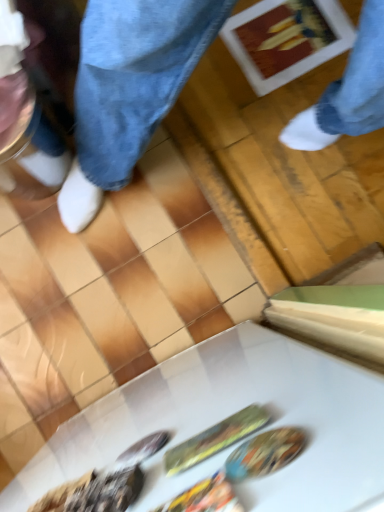
Measure the distance between white glossy table at lower center and camera.

The distance of white glossy table at lower center from camera is 7.87 inches.

This screenshot has height=512, width=384. Describe the element at coordinates (227, 416) in the screenshot. I see `white glossy table at lower center` at that location.

What do you see at coordinates (94, 493) in the screenshot? I see `shiny metallic spoon at lower left, the third food from the right` at bounding box center [94, 493].

Find the location of `shiny plastic bag at center, the second food from the left`. shiny plastic bag at center, the second food from the left is located at coordinates (205, 497).

From a real-world perspective, is shiny metallic spoon at lower left, placed as the first food when sorted from left to right, positioned above or below shiny plastic spoon at center, arranged as the first food when viewed from the right?

Clearly, from a real-world perspective, shiny metallic spoon at lower left, placed as the first food when sorted from left to right, is above shiny plastic spoon at center, arranged as the first food when viewed from the right.

Is shiny metallic spoon at lower left, placed as the first food when sorted from left to right, positioned before shiny plastic spoon at center, which ranks as the third food in left-to-right order?

Yes, it is in front of shiny plastic spoon at center, which ranks as the third food in left-to-right order.

Is shiny plastic spoon at center, arranged as the first food when viewed from the right, inside shiny metallic spoon at lower left, placed as the first food when sorted from left to right?

No, shiny plastic spoon at center, arranged as the first food when viewed from the right, is not inside shiny metallic spoon at lower left, placed as the first food when sorted from left to right.

At what (x,y) coordinates should I click in order to perform the action: click on food that is the 1st object located in front of the shiny plastic spoon at center, which ranks as the third food in left-to-right order. Please return your answer as a coordinate pair (x, y). This screenshot has width=384, height=512. Looking at the image, I should click on (94, 493).

In terms of height, does shiny plastic bag at center, the second food from the left, look taller or shorter compared to white glossy table at lower center?

Considering their sizes, shiny plastic bag at center, the second food from the left, has less height than white glossy table at lower center.

Is shiny plastic bag at center, positioned as the second food in right-to-left order, far away from white glossy table at lower center?

No.

In the image, is shiny plastic bag at center, the second food from the left, positioned in front of or behind white glossy table at lower center?

Clearly, shiny plastic bag at center, the second food from the left, is behind white glossy table at lower center.

Where is `table below the shiny plastic bag at center, the second food from the left (from the image's perspective)`? This screenshot has width=384, height=512. table below the shiny plastic bag at center, the second food from the left (from the image's perspective) is located at coordinates (227, 416).

Based on their positions, is shiny plastic spoon at center, arranged as the first food when viewed from the right, located to the left or right of shiny plastic bag at center, positioned as the second food in right-to-left order?

shiny plastic spoon at center, arranged as the first food when viewed from the right, is positioned on shiny plastic bag at center, positioned as the second food in right-to-left order,'s right side.

Consider the image. From a real-world perspective, is shiny plastic spoon at center, which ranks as the third food in left-to-right order, over shiny plastic bag at center, the second food from the left?

No.

Looking at the image, does shiny plastic spoon at center, arranged as the first food when viewed from the right, seem bigger or smaller compared to shiny plastic bag at center, positioned as the second food in right-to-left order?

Considering their sizes, shiny plastic spoon at center, arranged as the first food when viewed from the right, takes up more space than shiny plastic bag at center, positioned as the second food in right-to-left order.

Is shiny plastic spoon at center, which ranks as the third food in left-to-right order, wider than shiny plastic bag at center, positioned as the second food in right-to-left order?

Incorrect, the width of shiny plastic spoon at center, which ranks as the third food in left-to-right order, does not surpass that of shiny plastic bag at center, positioned as the second food in right-to-left order.

Does white glossy table at lower center have a lesser height compared to shiny plastic spoon at center, which ranks as the third food in left-to-right order?

Incorrect, the height of white glossy table at lower center does not fall short of that of shiny plastic spoon at center, which ranks as the third food in left-to-right order.

Would you say shiny plastic spoon at center, arranged as the first food when viewed from the right, is part of white glossy table at lower center's contents?

That's correct, shiny plastic spoon at center, arranged as the first food when viewed from the right, is inside white glossy table at lower center.

Is shiny metallic spoon at lower left, the third food from the right, at the back of white glossy table at lower center?

No.

Based on the photo, is white glossy table at lower center taller than shiny metallic spoon at lower left, the third food from the right?

Yes.

From the image's perspective, is white glossy table at lower center located beneath shiny plastic bag at center, the second food from the left?

Correct, white glossy table at lower center appears lower than shiny plastic bag at center, the second food from the left, in the image.

From a real-world perspective, is white glossy table at lower center above or below shiny plastic bag at center, positioned as the second food in right-to-left order?

white glossy table at lower center is situated lower than shiny plastic bag at center, positioned as the second food in right-to-left order, in the real world.

Does point (361, 495) appear closer or farther from the camera than point (238, 508)?

Point (361, 495) is positioned closer to the camera compared to point (238, 508).

Is white glossy table at lower center completely or partially outside of shiny plastic bag at center, positioned as the second food in right-to-left order?

Yes.

Between shiny plastic bag at center, positioned as the second food in right-to-left order, and shiny plastic spoon at center, arranged as the first food when viewed from the right, which one has smaller size?

shiny plastic bag at center, positioned as the second food in right-to-left order, is smaller.

From the image's perspective, which is below, shiny plastic bag at center, positioned as the second food in right-to-left order, or shiny plastic spoon at center, arranged as the first food when viewed from the right?

From the image's view, shiny plastic bag at center, positioned as the second food in right-to-left order, is below.

In the scene shown: From a real-world perspective, does shiny plastic bag at center, positioned as the second food in right-to-left order, stand above shiny plastic spoon at center, which ranks as the third food in left-to-right order?

Yes, from a real-world perspective, shiny plastic bag at center, positioned as the second food in right-to-left order, is on top of shiny plastic spoon at center, which ranks as the third food in left-to-right order.

From a real-world perspective, count 1st foods upward from the shiny plastic spoon at center, arranged as the first food when viewed from the right, and point to it. Please provide its 2D coordinates.

[(94, 493)]

Identify the location of table located underneath the shiny plastic bag at center, positioned as the second food in right-to-left order (from a real-world perspective). The height and width of the screenshot is (512, 384). (227, 416).

Looking at the image, which one is located further to shiny plastic bag at center, positioned as the second food in right-to-left order, shiny metallic spoon at lower left, the third food from the right, or shiny plastic spoon at center, arranged as the first food when viewed from the right?

shiny metallic spoon at lower left, the third food from the right, is positioned further to the anchor shiny plastic bag at center, positioned as the second food in right-to-left order.

Which object lies further to the anchor point shiny plastic spoon at center, arranged as the first food when viewed from the right, shiny plastic bag at center, positioned as the second food in right-to-left order, or shiny metallic spoon at lower left, the third food from the right?

shiny metallic spoon at lower left, the third food from the right, is further to shiny plastic spoon at center, arranged as the first food when viewed from the right.

Based on the photo, from the image, which object appears to be farther from shiny plastic spoon at center, arranged as the first food when viewed from the right, shiny metallic spoon at lower left, placed as the first food when sorted from left to right, or white glossy table at lower center?

The object further to shiny plastic spoon at center, arranged as the first food when viewed from the right, is white glossy table at lower center.

Which object lies further to the anchor point white glossy table at lower center, shiny plastic bag at center, positioned as the second food in right-to-left order, or shiny metallic spoon at lower left, the third food from the right?

shiny plastic bag at center, positioned as the second food in right-to-left order, lies further to white glossy table at lower center than the other object.

Consider the image. Estimate the real-world distances between objects in this image. Which object is further from white glossy table at lower center, shiny plastic bag at center, the second food from the left, or shiny plastic spoon at center, which ranks as the third food in left-to-right order?

shiny plastic bag at center, the second food from the left.

In the scene shown: Looking at the image, which one is located further to shiny plastic bag at center, the second food from the left, shiny plastic spoon at center, arranged as the first food when viewed from the right, or shiny metallic spoon at lower left, the third food from the right?

shiny metallic spoon at lower left, the third food from the right, lies further to shiny plastic bag at center, the second food from the left, than the other object.

From the image, which object appears to be farther from shiny metallic spoon at lower left, the third food from the right, shiny plastic spoon at center, which ranks as the third food in left-to-right order, or shiny plastic bag at center, positioned as the second food in right-to-left order?

The object further to shiny metallic spoon at lower left, the third food from the right, is shiny plastic bag at center, positioned as the second food in right-to-left order.

Looking at the image, which one is located further to shiny metallic spoon at lower left, the third food from the right, white glossy table at lower center or shiny plastic spoon at center, arranged as the first food when viewed from the right?

white glossy table at lower center lies further to shiny metallic spoon at lower left, the third food from the right, than the other object.

The image size is (384, 512). Identify the location of food between shiny plastic bag at center, the second food from the left, and white glossy table at lower center, in the vertical direction. (94, 493).

At what (x,y) coordinates should I click in order to perform the action: click on food located between shiny metallic spoon at lower left, the third food from the right, and shiny plastic spoon at center, which ranks as the third food in left-to-right order, in the left-right direction. Please return your answer as a coordinate pair (x, y). The width and height of the screenshot is (384, 512). Looking at the image, I should click on (205, 497).